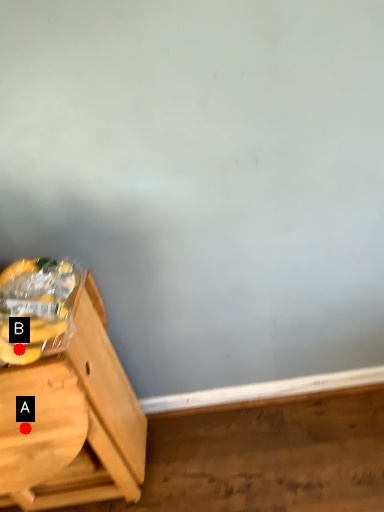
Question: Two points are circled on the image, labeled by A and B beside each circle. Which point is closer to the camera taking this photo?

Choices:
 (A) A is closer
 (B) B is closer

Answer: (B)